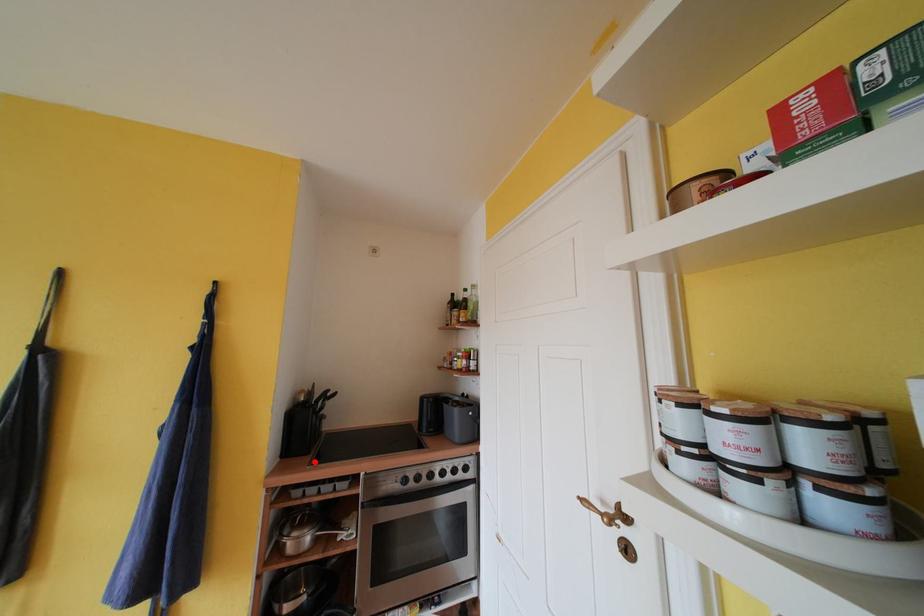
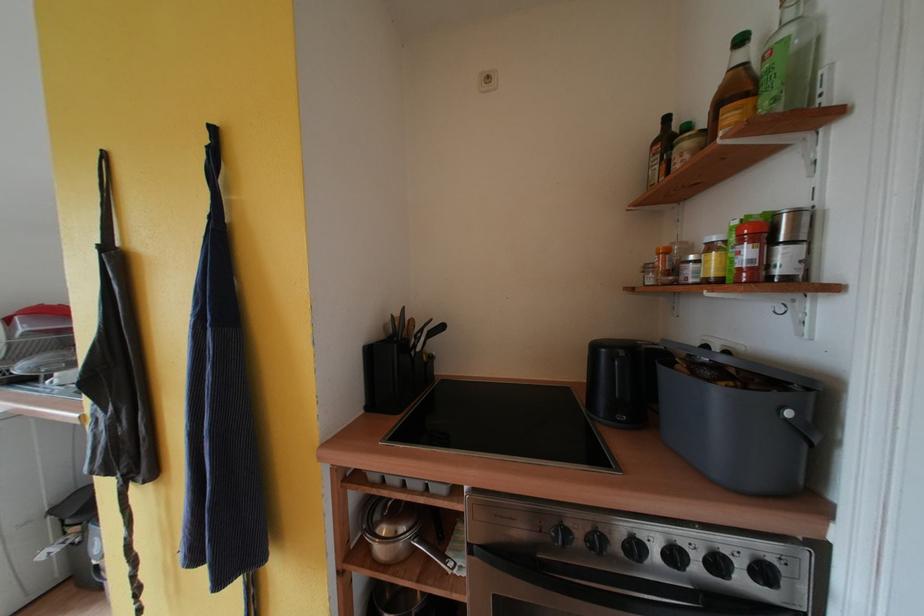
The point at the highlighted location is marked in the first image. Where is the corresponding point in the second image?

(399, 426)